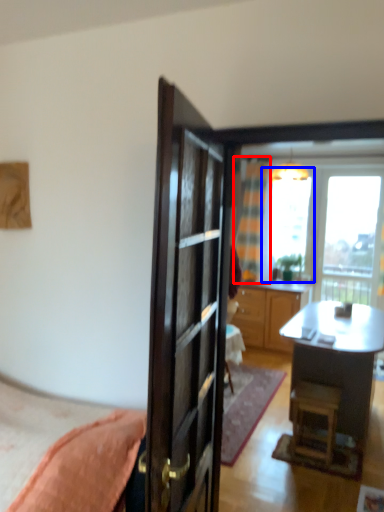
Question: Which of the following is the farthest to the observer, curtain (highlighted by a red box) or window screen (highlighted by a blue box)?

Choices:
 (A) curtain
 (B) window screen

Answer: (B)